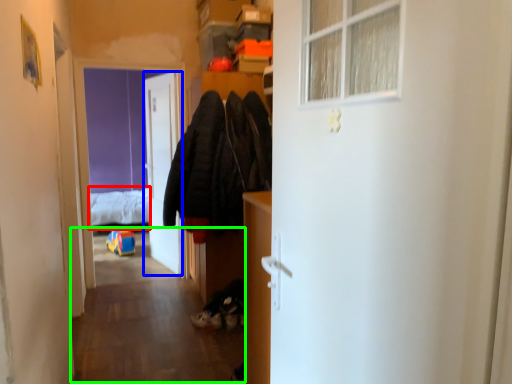
Question: Based on their relative distances, which object is nearer to bed (highlighted by a red box)? Choose from door (highlighted by a blue box) and corridor (highlighted by a green box).

Choices:
 (A) door
 (B) corridor

Answer: (A)